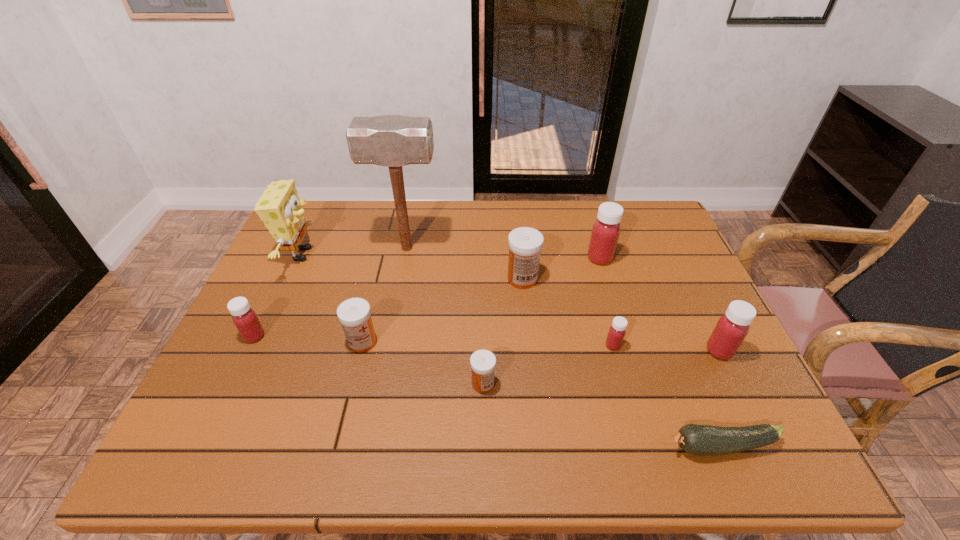
Find the location of `mallet that is at the far edge`. mallet that is at the far edge is located at coordinates (392, 141).

At what (x,y) coordinates should I click in order to perform the action: click on sponge that is positioned at the far edge. Please return your answer as a coordinate pair (x, y). The image size is (960, 540). Looking at the image, I should click on (280, 208).

The height and width of the screenshot is (540, 960). Identify the location of object present at the near edge. (697, 439).

Locate an element on the screen. sponge present at the left edge is located at coordinates (280, 208).

Identify the location of medicine positioned at the left edge. This screenshot has height=540, width=960. (245, 319).

Where is `medicine present at the right edge`? Image resolution: width=960 pixels, height=540 pixels. medicine present at the right edge is located at coordinates (731, 329).

This screenshot has width=960, height=540. In order to click on zucchini present at the right edge in this screenshot , I will do `click(697, 439)`.

I want to click on object present at the far left corner, so (280, 208).

This screenshot has height=540, width=960. Find the location of `object at the near right corner`. object at the near right corner is located at coordinates (697, 439).

Locate an element on the screen. blank space at the far edge of the desktop is located at coordinates (348, 231).